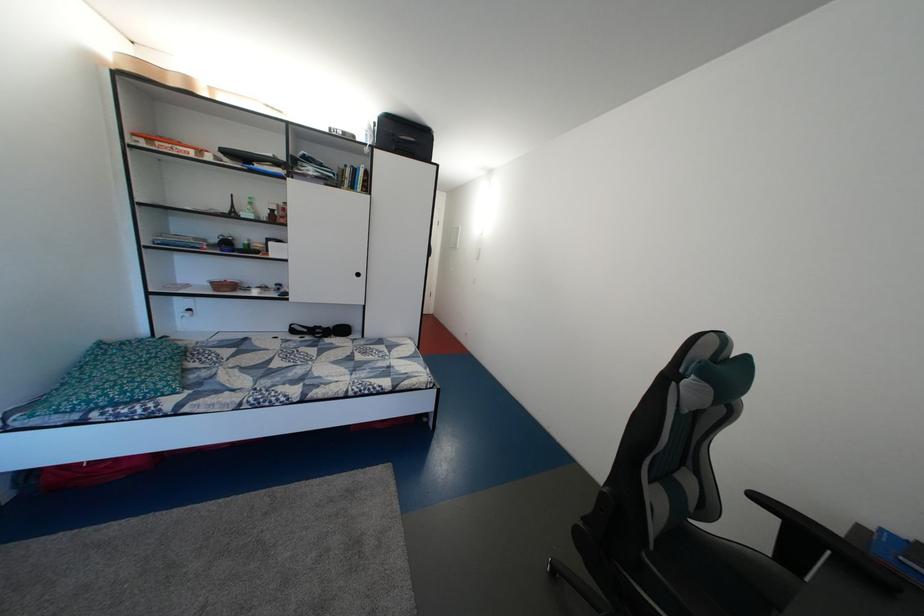
Where would you sit the bed sitting surface? Please return your answer as a coordinate pair (x, y).

(300, 369)